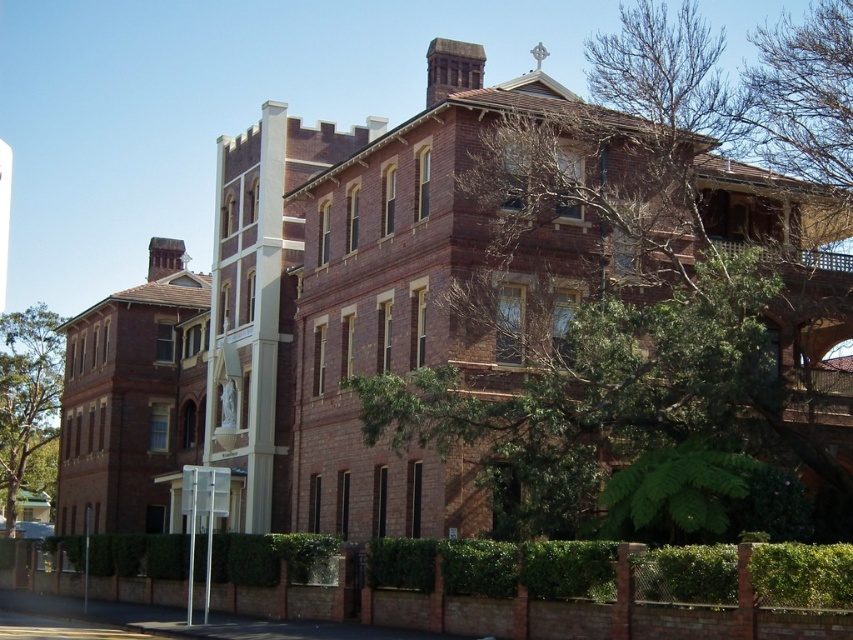
Question: Estimate the real-world distances between objects in this image. Which object is farther from the white glossy pole at center?

Choices:
 (A) green leafy tree at lower left
 (B) green leafy tree at upper right

Answer: (A)

Question: Which point is farther from the camera taking this photo?

Choices:
 (A) (84, 568)
 (B) (602, 109)
 (C) (27, 464)

Answer: (C)

Question: Does white glossy pole at center appear over metallic pole at lower left?

Choices:
 (A) yes
 (B) no

Answer: (A)

Question: Can you confirm if green leafy tree at upper right is positioned to the right of white glossy pole at center?

Choices:
 (A) no
 (B) yes

Answer: (B)

Question: Is green leafy tree at lower left further to camera compared to metallic pole at lower left?

Choices:
 (A) no
 (B) yes

Answer: (B)

Question: Which point is farther from the camera taking this photo?

Choices:
 (A) (496, 250)
 (B) (85, 595)
 (C) (192, 525)

Answer: (B)